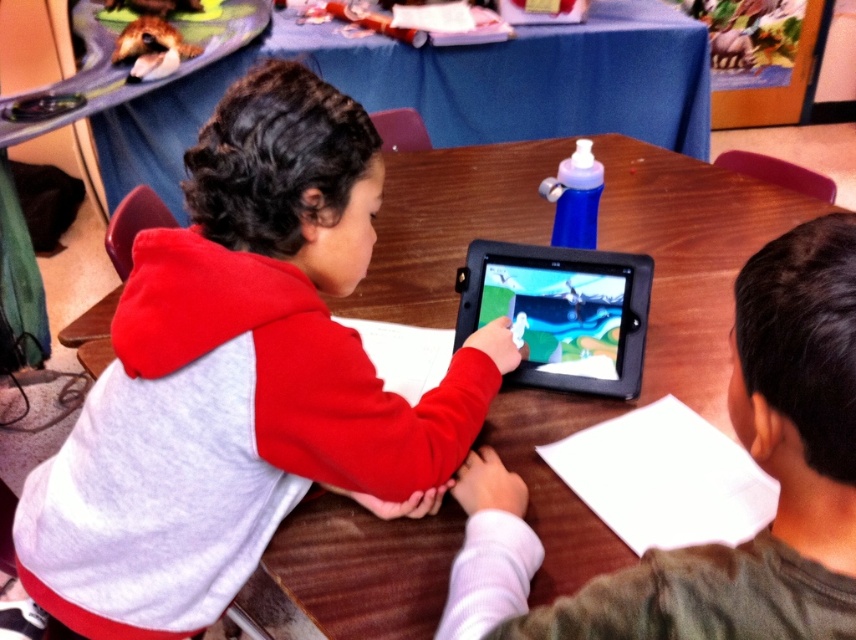
You are a parent observing your children at the table. You need to place a small toy between the matte red hoodie at center and the smooth black tablet at center. Which object should the toy be closer to if you want it to be nearer to the smaller object?

The smooth black tablet at center is smaller than the matte red hoodie at center. Therefore, placing the toy closer to the smooth black tablet at center will make it nearer to the smaller object.